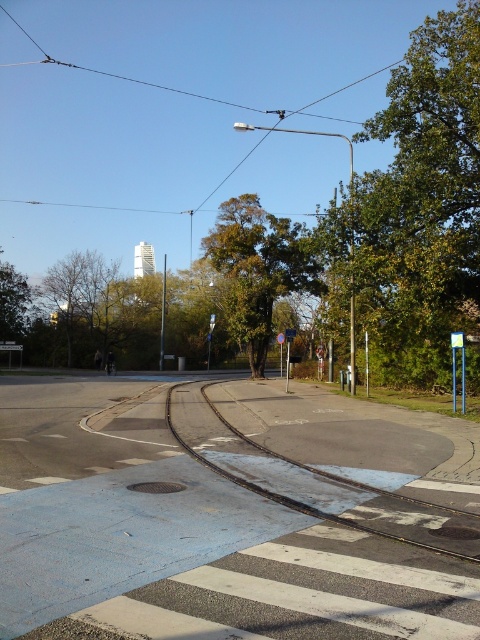
Find the location of `green leafy tree at center`. green leafy tree at center is located at coordinates (257, 269).

Is point (300, 241) closer to viewer compared to point (85, 257)?

Yes, it is.

Find the location of a particular element. green leafy tree at center is located at coordinates (257, 269).

Is green leafy tree at upper center closer to camera compared to smooth asphalt train track at center?

No, green leafy tree at upper center is further to the viewer.

Describe the element at coordinates (80, 296) in the screenshot. This screenshot has width=480, height=640. I see `green leafy tree at upper center` at that location.

Between point (90, 300) and point (169, 403), which one is positioned in front?

Point (169, 403) is more forward.

Locate an element on the screen. Image resolution: width=480 pixels, height=640 pixels. green leafy tree at upper center is located at coordinates (80, 296).

Looking at this image, which is more to the left, smooth asphalt train track at center or green leafy tree at left?

Positioned to the left is green leafy tree at left.

Looking at this image, can you confirm if smooth asphalt train track at center is positioned to the right of green leafy tree at left?

Indeed, smooth asphalt train track at center is positioned on the right side of green leafy tree at left.

Between point (189, 381) and point (19, 323), which one is positioned in front?

Point (189, 381) is more forward.

Locate an element on the screen. This screenshot has width=480, height=640. smooth asphalt train track at center is located at coordinates (296, 499).